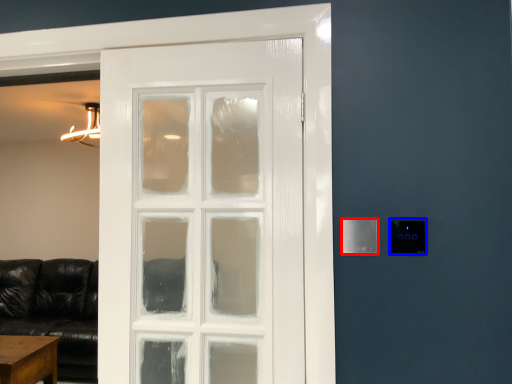
Question: Among these objects, which one is nearest to the camera, light switch (highlighted by a red box) or light switch (highlighted by a blue box)?

Choices:
 (A) light switch
 (B) light switch

Answer: (B)